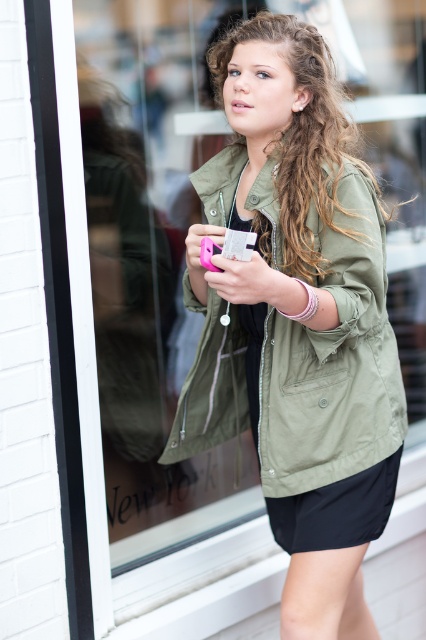
Based on the photo, which of these two, olive green fabric jacket at center or black smooth shorts at lower center, stands shorter?

With less height is black smooth shorts at lower center.

Is olive green fabric jacket at center shorter than black smooth shorts at lower center?

No.

Which is behind, point (363, 182) or point (313, 540)?

Point (313, 540)

This screenshot has height=640, width=426. Find the location of `olive green fabric jacket at center`. olive green fabric jacket at center is located at coordinates (333, 358).